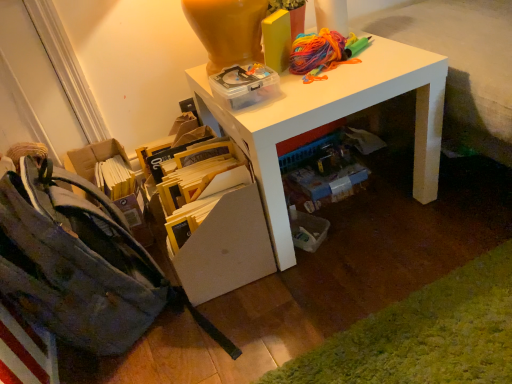
The height and width of the screenshot is (384, 512). I want to click on free point in front of yellow cardboard at lower left, so click(x=274, y=335).